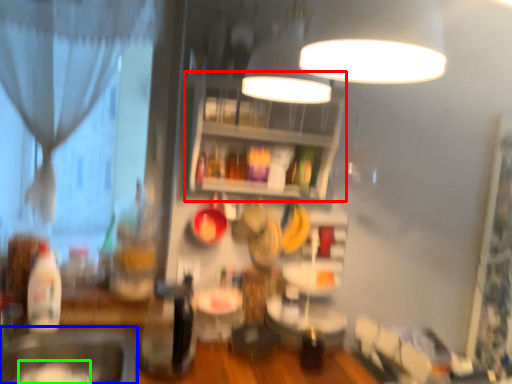
Question: Which object is positioned closest to shelf (highlighted by a red box)? Select from sink (highlighted by a blue box) and food (highlighted by a green box).

Choices:
 (A) sink
 (B) food

Answer: (A)